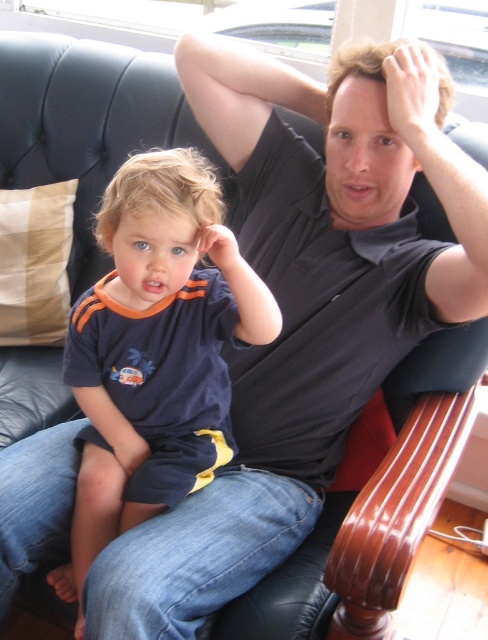
Is smooth black hair at upper center smaller than blonde hair at center?

Yes.

Is point (393, 200) in front of point (182, 179)?

No.

Find the location of a particular element. This screenshot has width=488, height=640. smooth black hair at upper center is located at coordinates pos(365,150).

Based on the photo, can you confirm if matte blue t-shirt at left is shorter than blonde hair at center?

No.

Does matte blue t-shirt at left have a smaller size compared to blonde hair at center?

No, matte blue t-shirt at left is not smaller than blonde hair at center.

This screenshot has width=488, height=640. Identify the location of matte blue t-shirt at left. (156, 349).

Who is positioned more to the left, matte blue t-shirt at left or smooth black hair at upper center?

Positioned to the left is matte blue t-shirt at left.

Image resolution: width=488 pixels, height=640 pixels. What are the coordinates of `matte blue t-shirt at left` in the screenshot? It's located at (156, 349).